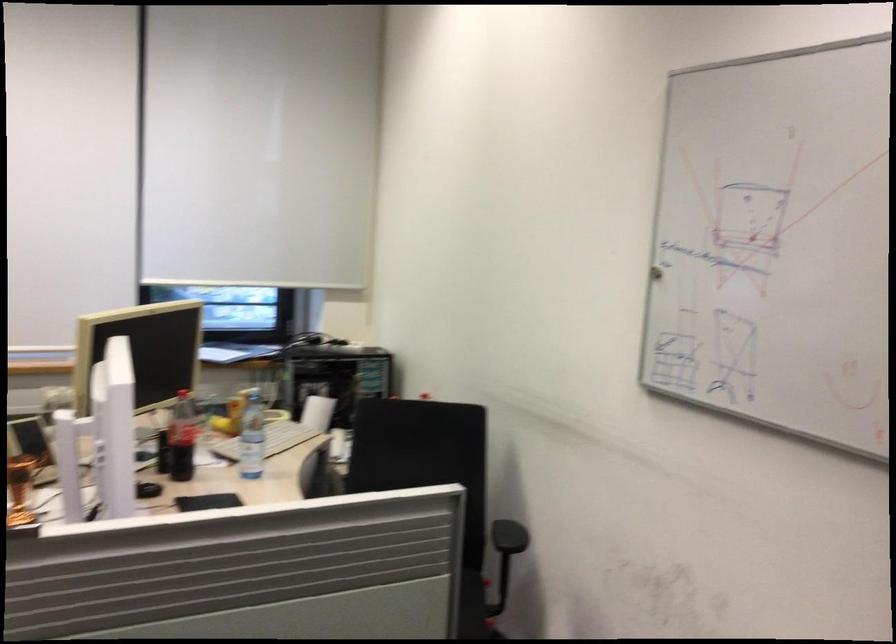
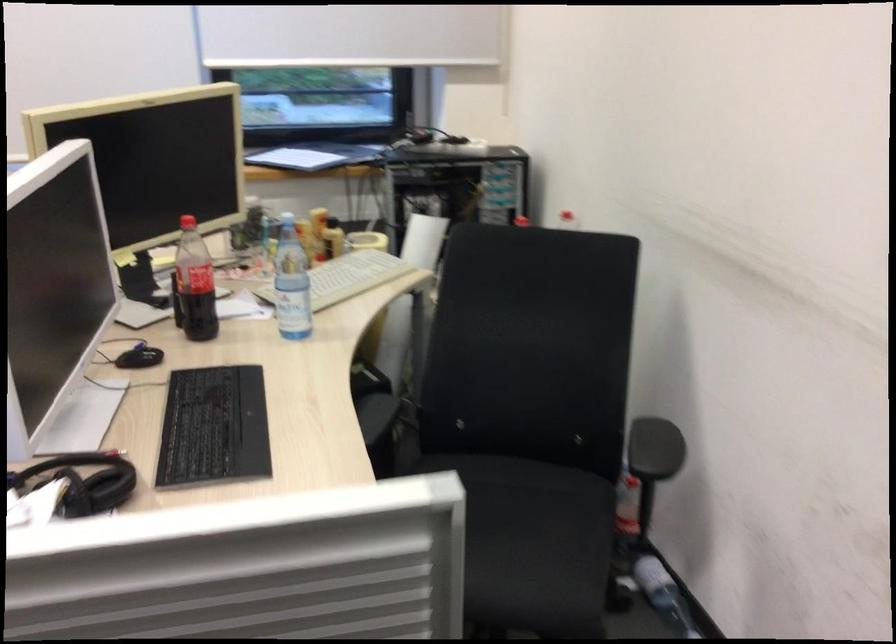
In the second image, find the point that corresponds to the point at 266,436 in the first image.

(347, 277)